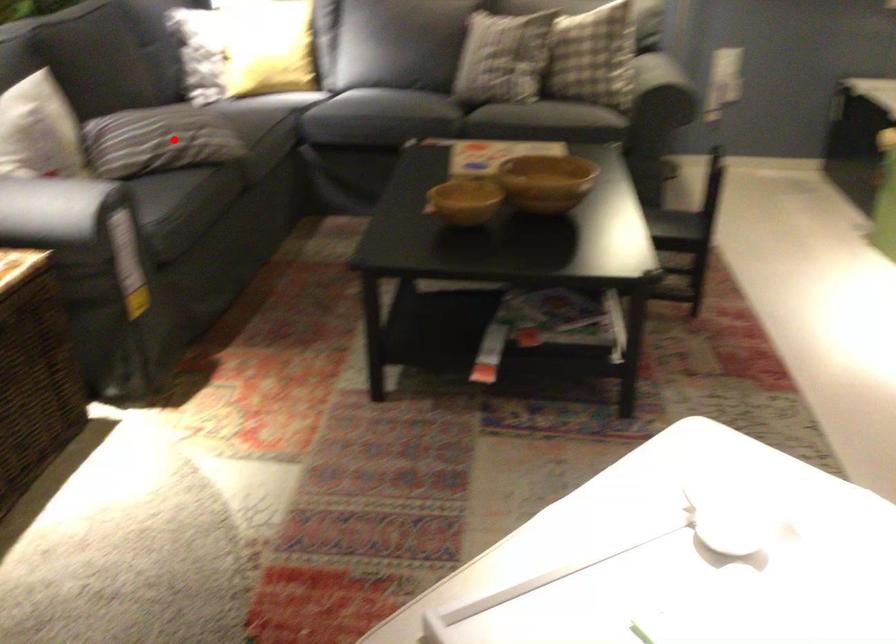
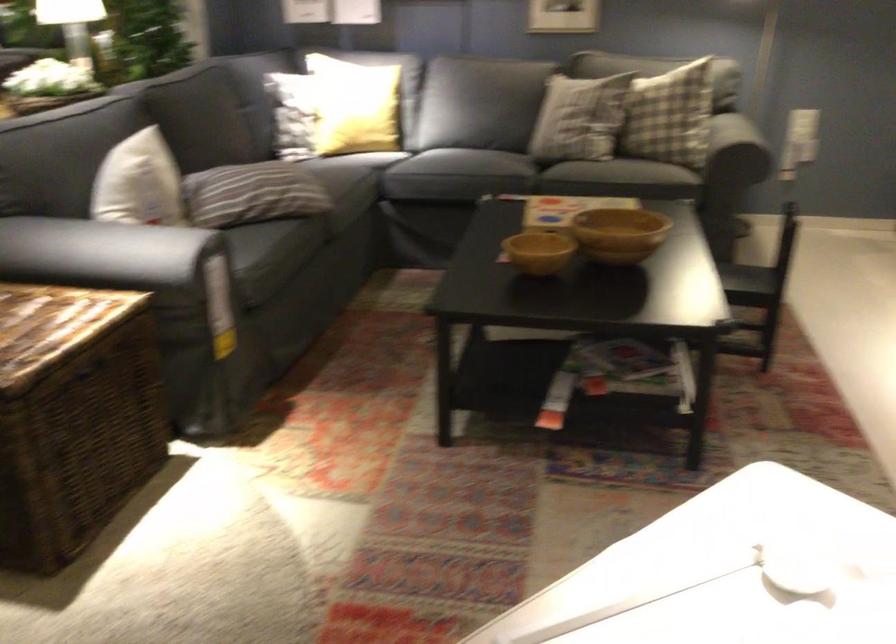
Find the pixel in the second image that matches the highlighted location in the first image.

(261, 194)